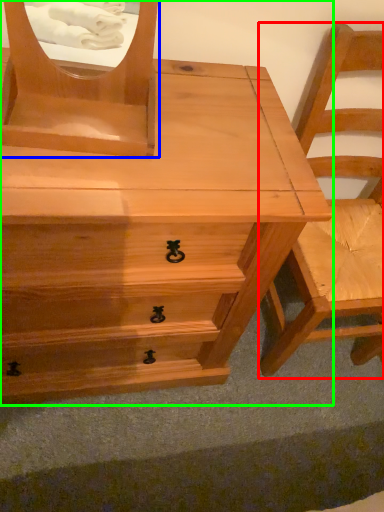
Question: Based on their relative distances, which object is farther from chair (highlighted by a red box)? Choose from mirror (highlighted by a blue box) and chest of drawers (highlighted by a green box).

Choices:
 (A) mirror
 (B) chest of drawers

Answer: (A)